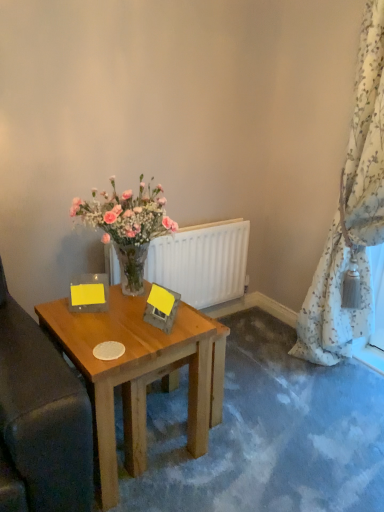
Identify the location of free spot above white matte radiator at center (from a real-world perspective). (211, 224).